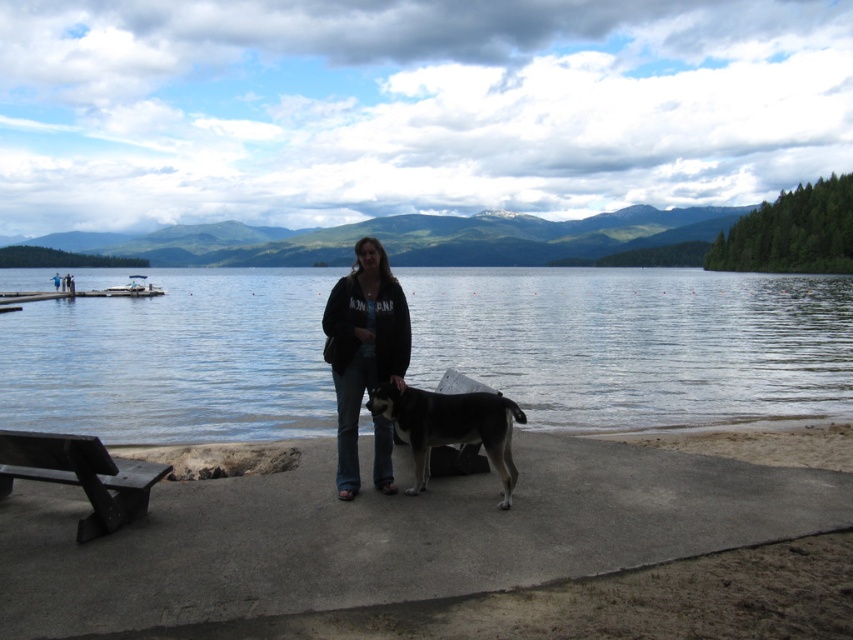
You are planning to place a small wooden bench between the clear water at center and the dark gray fleece jacket at center. Which object should the bench be closer to if you want it to be equidistant from both?

The bench should be placed closer to the dark gray fleece jacket at center because the clear water at center is wider than the jacket, so to balance the distance, the bench needs to be nearer to the narrower object.

You are standing at the edge of the lake and see two points marked in the scene. Which point is closer to you, point (396, 292) or point (509, 497)?

Point (396, 292) is closer to you because it is further to the viewer than point (509, 497).